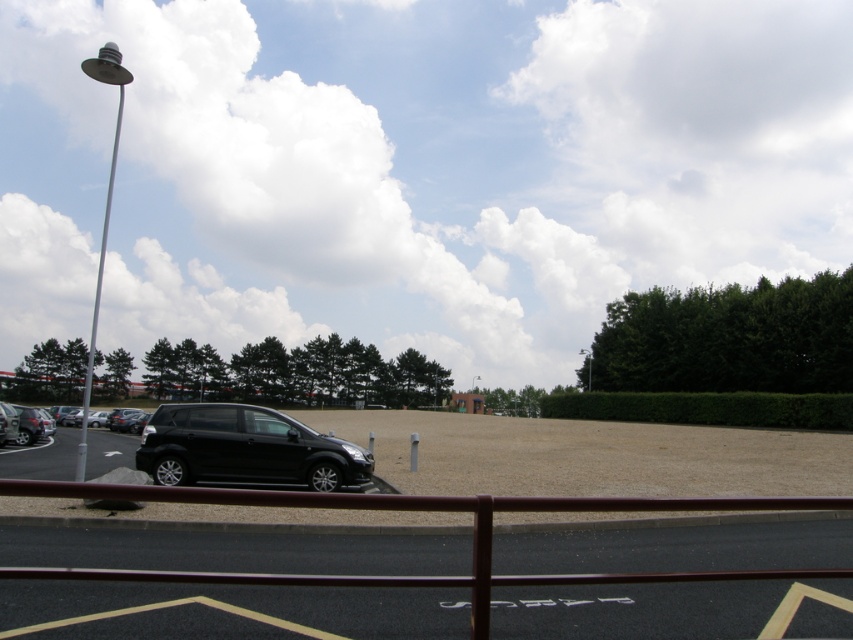
Question: Among these points, which one is nearest to the camera?

Choices:
 (A) (128, 412)
 (B) (106, 445)
 (C) (273, 621)
 (D) (318, 486)

Answer: (C)

Question: Which of the following is the farthest from the observer?

Choices:
 (A) (48, 448)
 (B) (294, 452)
 (C) (67, 602)

Answer: (A)

Question: Which point appears farthest from the camera in this image?

Choices:
 (A) (712, 532)
 (B) (322, 451)
 (C) (126, 449)
 (D) (85, 420)

Answer: (C)

Question: Does black matte car at lower left have a lesser width compared to shiny black suv at left?

Choices:
 (A) yes
 (B) no

Answer: (A)

Question: Is black matte car at lower left above shiny black suv at left?

Choices:
 (A) no
 (B) yes

Answer: (B)

Question: Is black matte suv at center wider than black matte car at lower left?

Choices:
 (A) no
 (B) yes

Answer: (A)